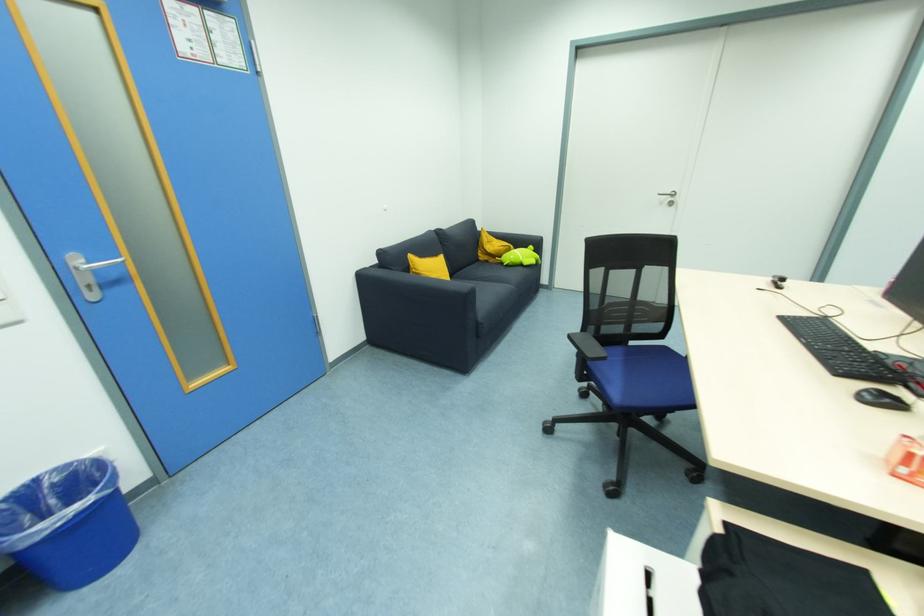
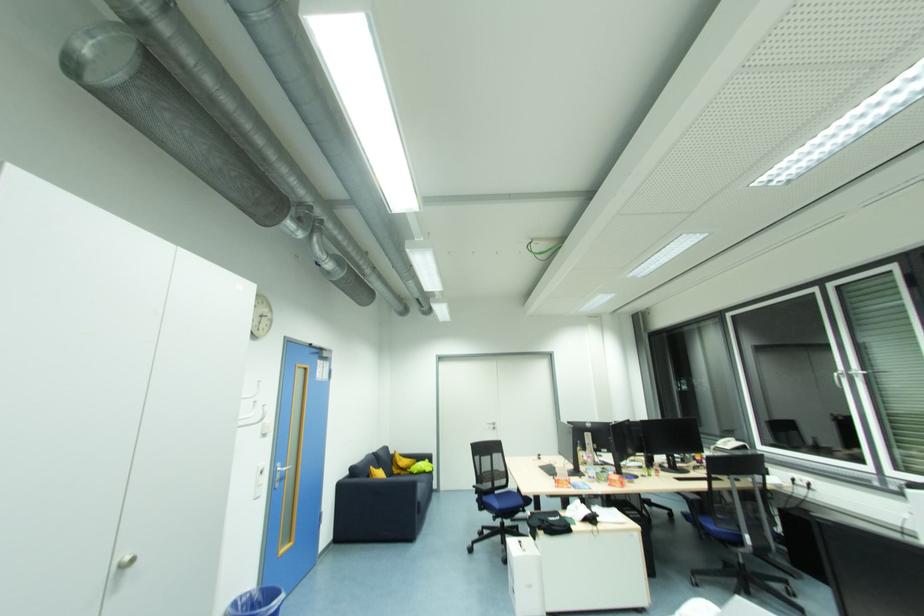
Find the pixel in the second image that matches pixel 636 344 in the first image.

(500, 493)